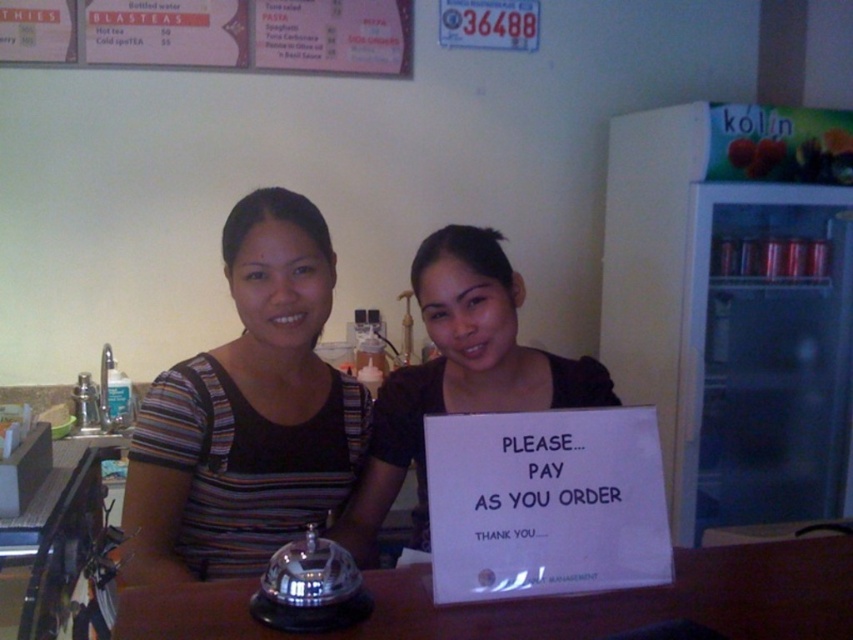
Question: Is matte brown shirt at center in front of pink paper menu at upper center?

Choices:
 (A) no
 (B) yes

Answer: (B)

Question: Is matte brown shirt at center further to camera compared to pink paper menu at upper center?

Choices:
 (A) yes
 (B) no

Answer: (B)

Question: Which object appears farthest from the camera in this image?

Choices:
 (A) brown wooden table at center
 (B) pink paper menu at upper center

Answer: (B)

Question: Which point appears closest to the camera in this image?

Choices:
 (A) (241, 449)
 (B) (190, 22)
 (C) (843, 541)
 (D) (390, 445)

Answer: (C)

Question: Is striped fabric shirt at center to the left of brown wooden table at center from the viewer's perspective?

Choices:
 (A) no
 (B) yes

Answer: (B)

Question: Which object appears closest to the camera in this image?

Choices:
 (A) matte brown shirt at center
 (B) brown wooden table at center
 (C) striped fabric shirt at center

Answer: (B)